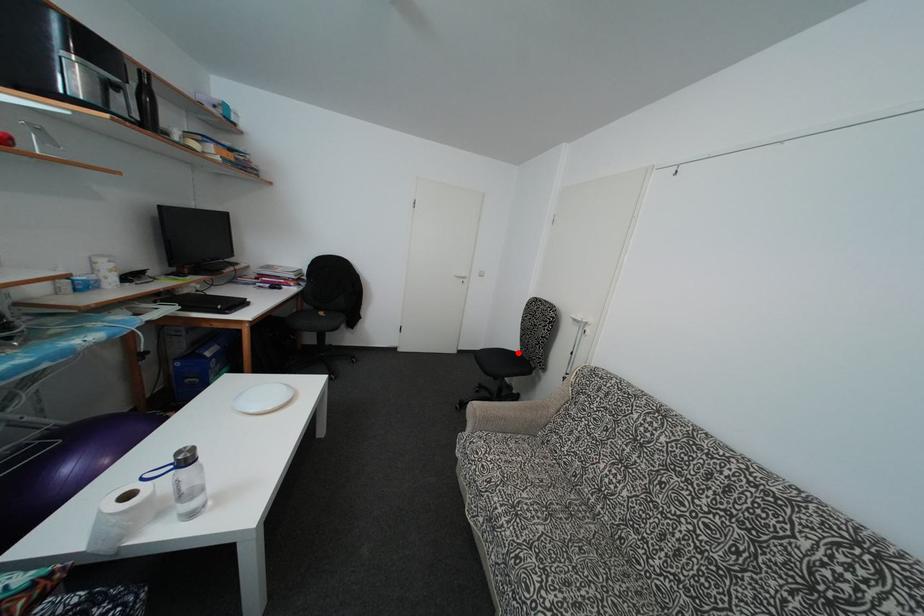
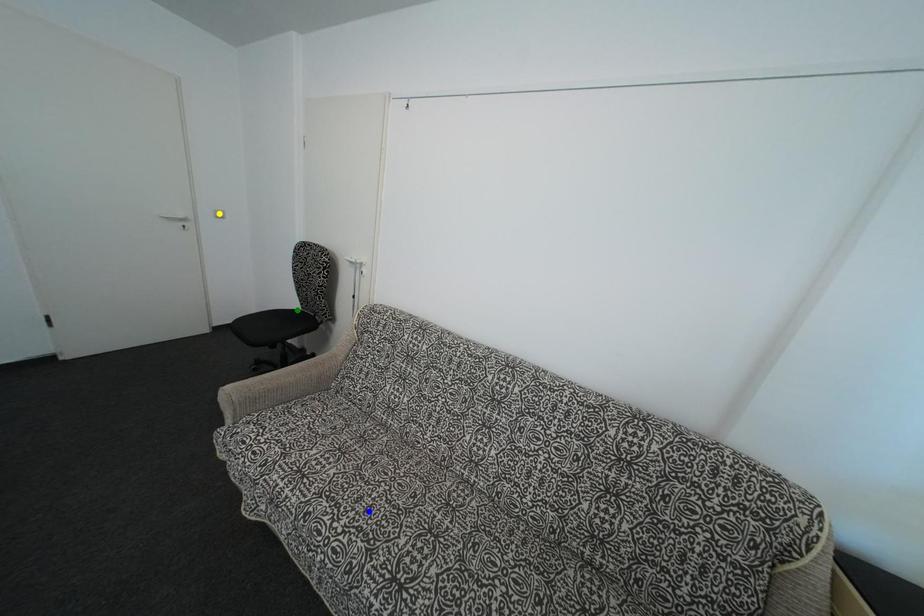
Question: I am providing you with two images of the same scene from different viewpoints. A red point is marked on the first image. You are given multiple points on the second image. In image 2, which mark is for the same physical point as the one in image 1?

Choices:
 (A) yellow point
 (B) green point
 (C) blue point

Answer: (B)